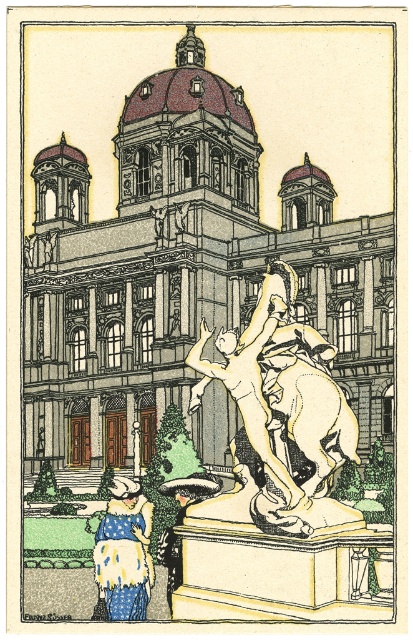
Is gold polished statue at center closer to camera compared to white dotted dress at lower left?

Yes.

Is point (329, 442) more distant than point (128, 529)?

No, it is in front of (128, 529).

In order to click on gold polished statue at center in this screenshot , I will do `click(284, 410)`.